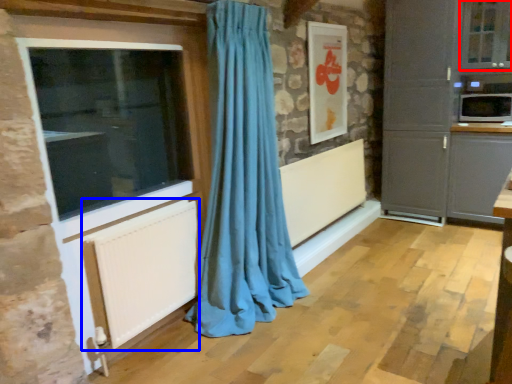
Question: Which of the following is the farthest to the observer, window (highlighted by a red box) or radiator (highlighted by a blue box)?

Choices:
 (A) window
 (B) radiator

Answer: (A)